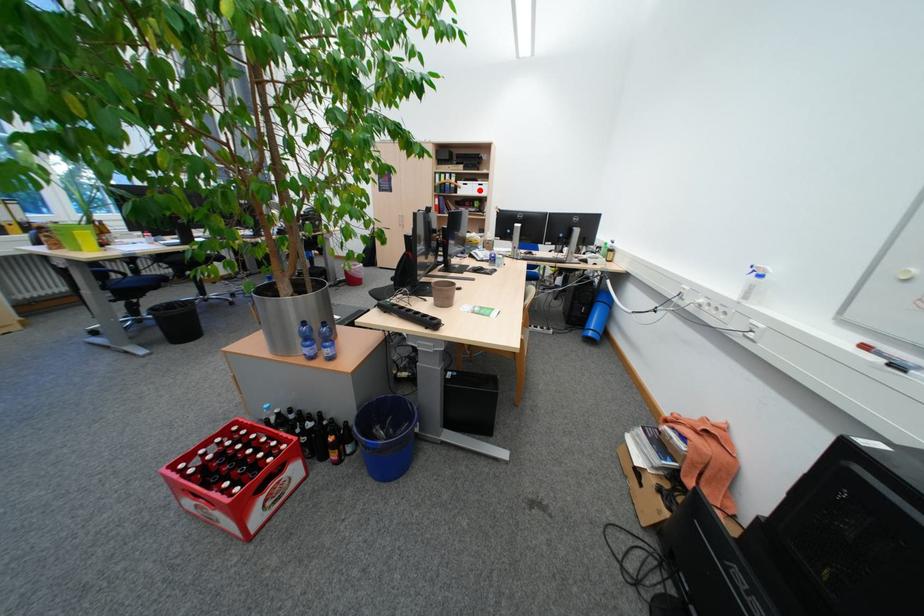
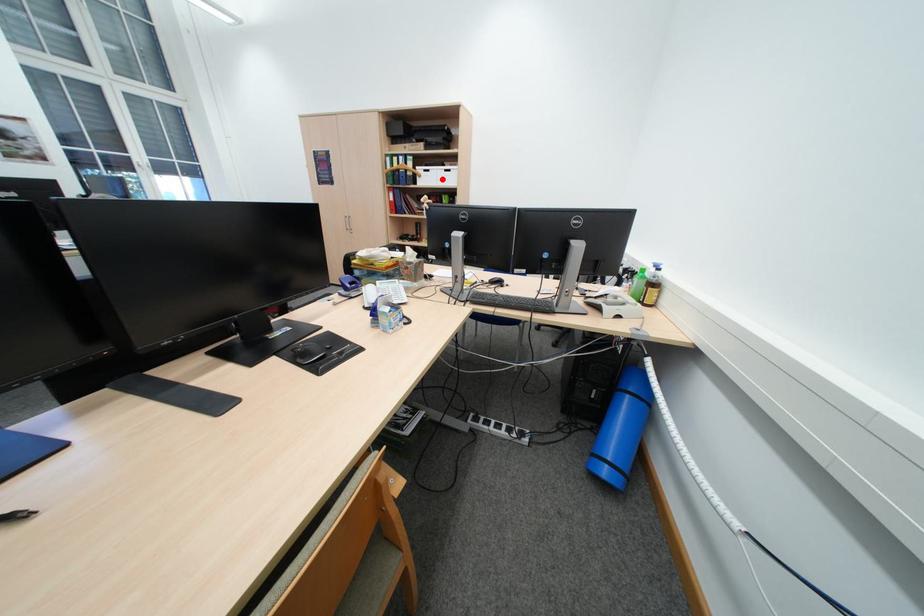
I am providing you with two images of the same scene from different viewpoints. A red point is marked on the first image and another point is marked on the second image. Is the red point in image1 aligned with the point shown in image2?

Yes